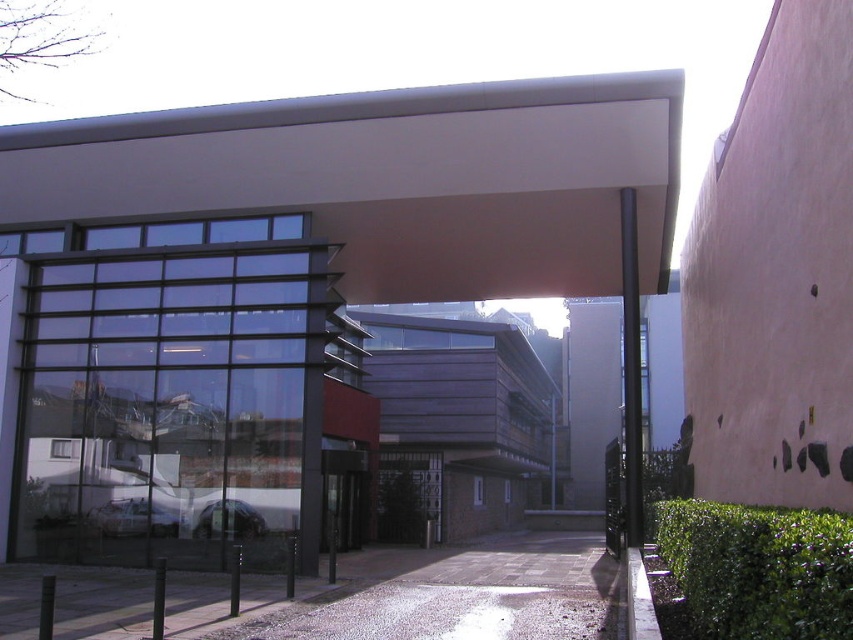
Is point (144, 532) in front of point (219, 515)?

That is False.

Which of these two, metallic silver car at center or shiny silver car at center, stands taller?

With more height is metallic silver car at center.

I want to click on metallic silver car at center, so pos(132,518).

I want to click on metallic silver car at center, so click(x=132, y=518).

Between black glass door at center and metallic silver car at center, which one is positioned lower?

Positioned lower is black glass door at center.

Does black glass door at center have a larger size compared to metallic silver car at center?

Yes.

Between point (338, 454) and point (109, 525), which one is positioned behind?

The point (338, 454) is more distant.

The height and width of the screenshot is (640, 853). Identify the location of black glass door at center. (343, 493).

Measure the distance between black glass door at center and camera.

black glass door at center is 17.85 meters away from camera.

The height and width of the screenshot is (640, 853). Identify the location of black glass door at center. (343, 493).